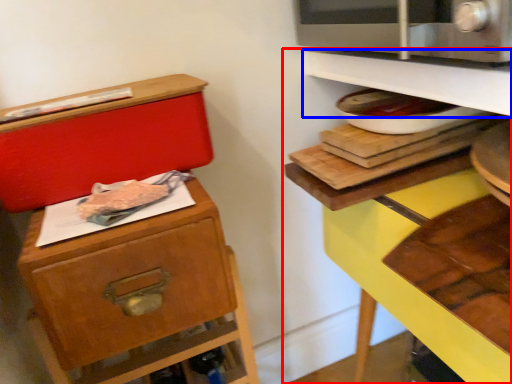
Question: Among these objects, which one is nearest to the camera, shelf (highlighted by a red box) or shelf (highlighted by a blue box)?

Choices:
 (A) shelf
 (B) shelf

Answer: (A)